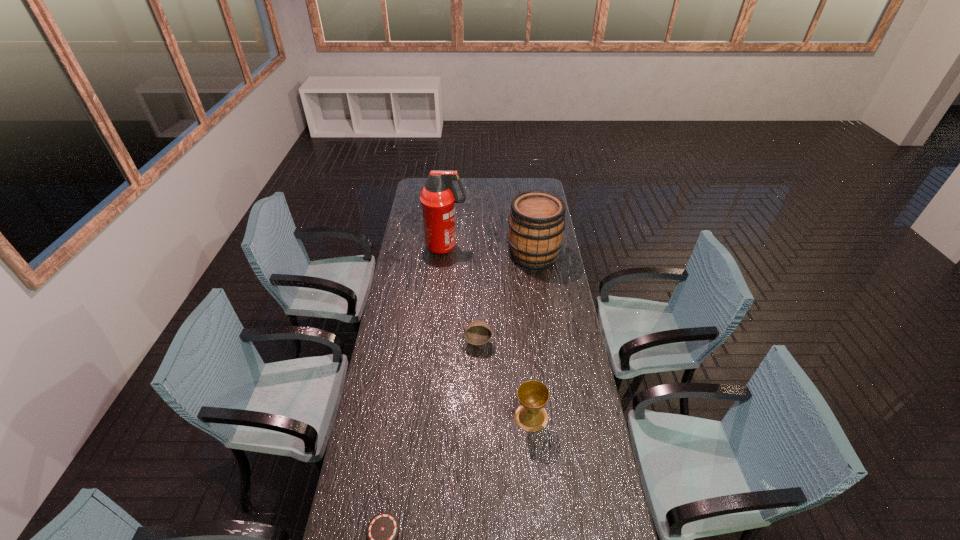
What are the coordinates of `object at the left edge` in the screenshot? It's located at (438, 197).

What are the coordinates of `object at the right edge` in the screenshot? It's located at (536, 223).

The width and height of the screenshot is (960, 540). Identify the location of blank space at the far edge of the desktop. 460,187.

At what (x,y) coordinates should I click in order to perform the action: click on free location at the left edge. Please return your answer as a coordinate pair (x, y). The height and width of the screenshot is (540, 960). Looking at the image, I should click on (414, 256).

Identify the location of vacant space at the right edge. (x=560, y=294).

I want to click on empty space between the third object from left to right and the chalice, so click(505, 379).

You are a GUI agent. You are given a task and a screenshot of the screen. Output one action in this format:
    pyautogui.click(x=<x>, y=<y>)
    Task: Click on the free space that is in between the bowl and the fire extinguisher
    The height and width of the screenshot is (540, 960).
    Given the screenshot: What is the action you would take?
    pyautogui.click(x=462, y=293)

Locate an element on the screen. Image resolution: width=960 pixels, height=540 pixels. vacant space that's between the third nearest object and the fourth shortest object is located at coordinates (506, 297).

The height and width of the screenshot is (540, 960). Find the location of `vacant area that lies between the third farthest object and the tallest object`. vacant area that lies between the third farthest object and the tallest object is located at coordinates (462, 293).

Find the location of a particular element. vacant area between the tallest object and the third object from right to left is located at coordinates (462, 293).